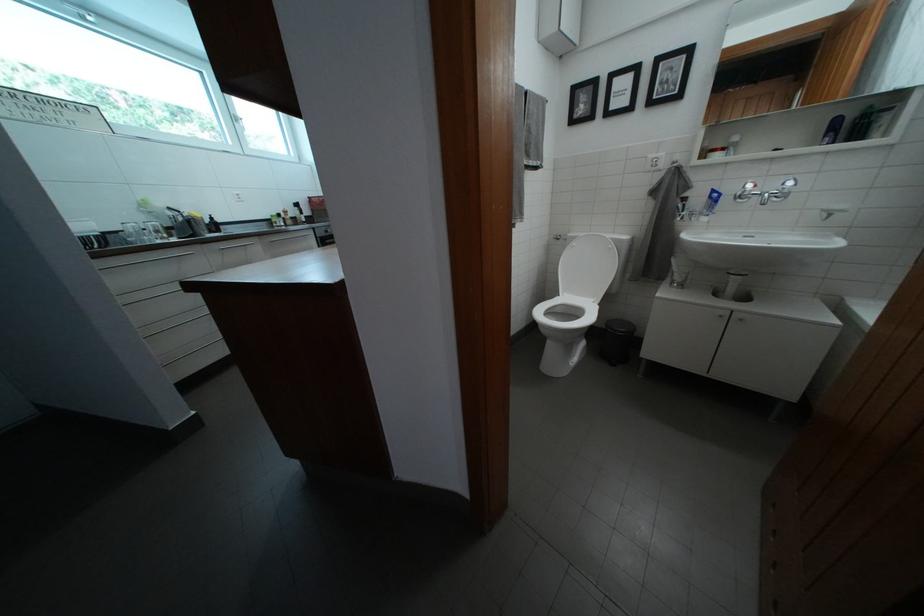
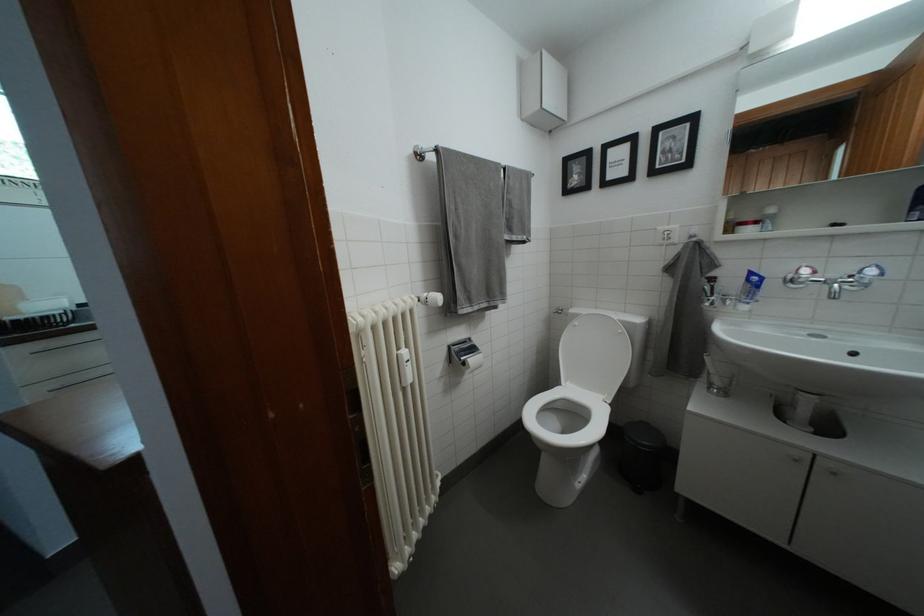
Where in the second image is the point corresponding to [582,244] from the first image?

(585, 321)